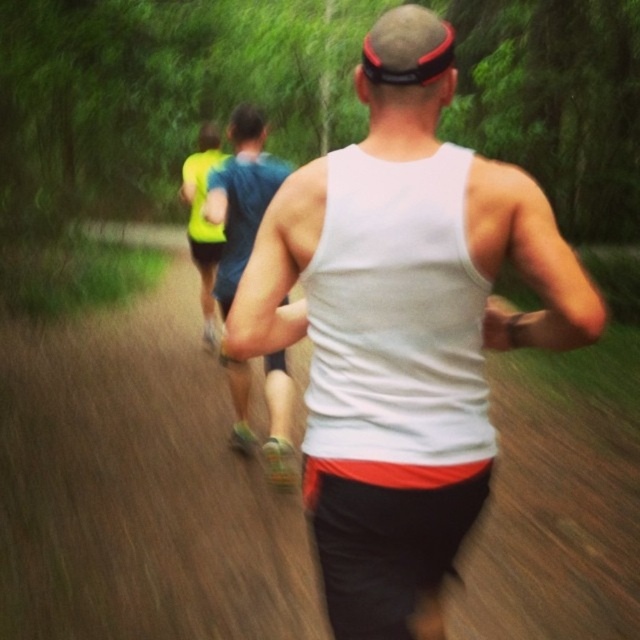
Question: Is white matte tank top at center to the right of blue fabric shirt at center from the viewer's perspective?

Choices:
 (A) no
 (B) yes

Answer: (B)

Question: Which object is closer to the camera taking this photo?

Choices:
 (A) blue fabric shirt at center
 (B) neon yellow reflective vest at center
 (C) white matte tank top at center

Answer: (C)

Question: From the image, what is the correct spatial relationship of white matte tank top at center in relation to blue fabric shirt at center?

Choices:
 (A) below
 (B) above

Answer: (B)

Question: Is white matte tank top at center below blue fabric shirt at center?

Choices:
 (A) yes
 (B) no

Answer: (B)

Question: Which object is the closest to the blue fabric shirt at center?

Choices:
 (A) neon yellow reflective vest at center
 (B) white matte tank top at center

Answer: (B)

Question: Among these points, which one is nearest to the camera?

Choices:
 (A) (275, 376)
 (B) (211, 237)

Answer: (A)